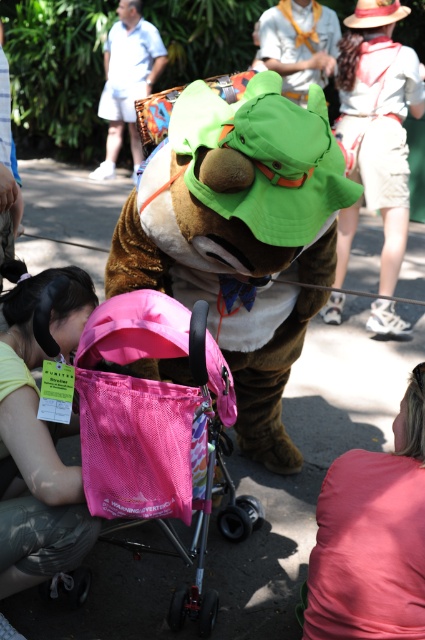
Question: Estimate the real-world distances between objects in this image. Which object is farther from the pink fabric shirt at lower right?

Choices:
 (A) brown furry mascot at center
 (B) green fabric backpack at upper center
 (C) brown furry costume at upper center
 (D) pink mesh stroller at center

Answer: (C)

Question: Is yellow-green fabric headband at lower left below brown furry costume at upper center?

Choices:
 (A) no
 (B) yes

Answer: (B)

Question: Does green fabric backpack at upper center have a lesser width compared to brown furry costume at upper center?

Choices:
 (A) no
 (B) yes

Answer: (B)

Question: Which is nearer to the green fabric hat at upper center?

Choices:
 (A) pink mesh stroller at center
 (B) white cotton shirt at upper right
 (C) yellow-green fabric headband at lower left

Answer: (B)

Question: Does pink mesh stroller at center lie in front of pink fabric shirt at lower right?

Choices:
 (A) yes
 (B) no

Answer: (A)

Question: Which of these objects is positioned farthest from the brown furry mascot at center?

Choices:
 (A) pink fabric shirt at lower right
 (B) green fabric backpack at upper center
 (C) white cotton shirt at upper right

Answer: (C)